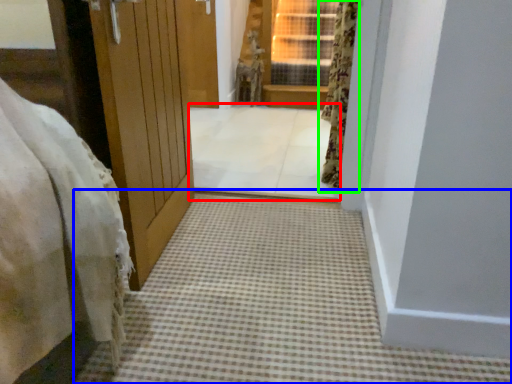
Question: Based on their relative distances, which object is nearer to passage (highlighted by a red box)? Choose from path (highlighted by a blue box) and curtain (highlighted by a green box).

Choices:
 (A) path
 (B) curtain

Answer: (B)